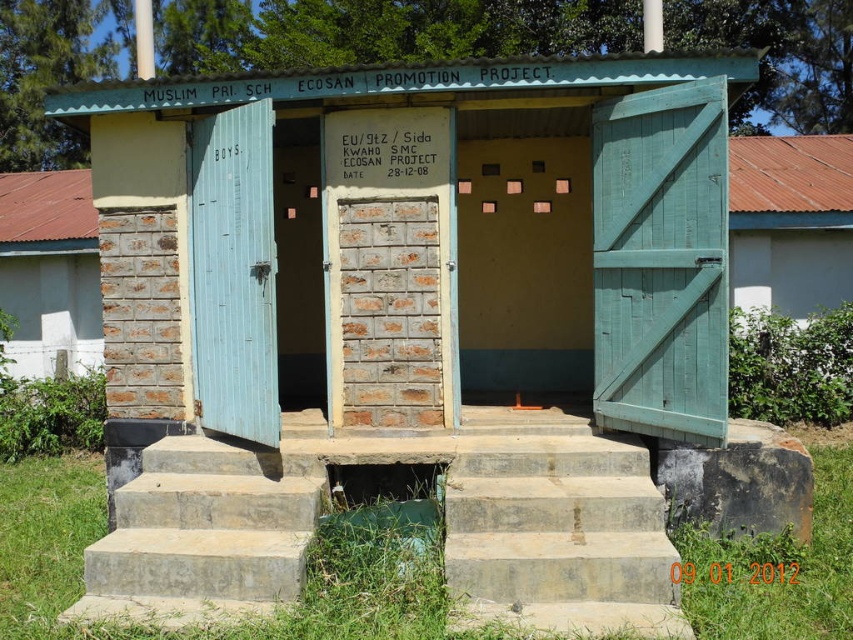
Who is shorter, concrete/steps at center or white smooth wall at upper right?

concrete/steps at center is shorter.

Where is `concrete/steps at center`? This screenshot has height=640, width=853. concrete/steps at center is located at coordinates (556, 529).

At what (x,y) coordinates should I click in order to perform the action: click on concrete/steps at center. Please return your answer as a coordinate pair (x, y). Looking at the image, I should click on (556, 529).

Where is `green grass at lower center`? green grass at lower center is located at coordinates (193, 628).

The height and width of the screenshot is (640, 853). Find the location of `green grass at lower center`. green grass at lower center is located at coordinates [193, 628].

The image size is (853, 640). Find the location of `green grass at lower center`. green grass at lower center is located at coordinates (193, 628).

Who is more forward, (239, 516) or (840, 193)?

Point (239, 516)

Does concrete/steps at lower center appear under white smooth wall at upper right?

Yes.

Is point (300, 440) farther from viewer compared to point (762, 276)?

No.

Find the location of a particular element. The height and width of the screenshot is (640, 853). concrete/steps at lower center is located at coordinates (206, 534).